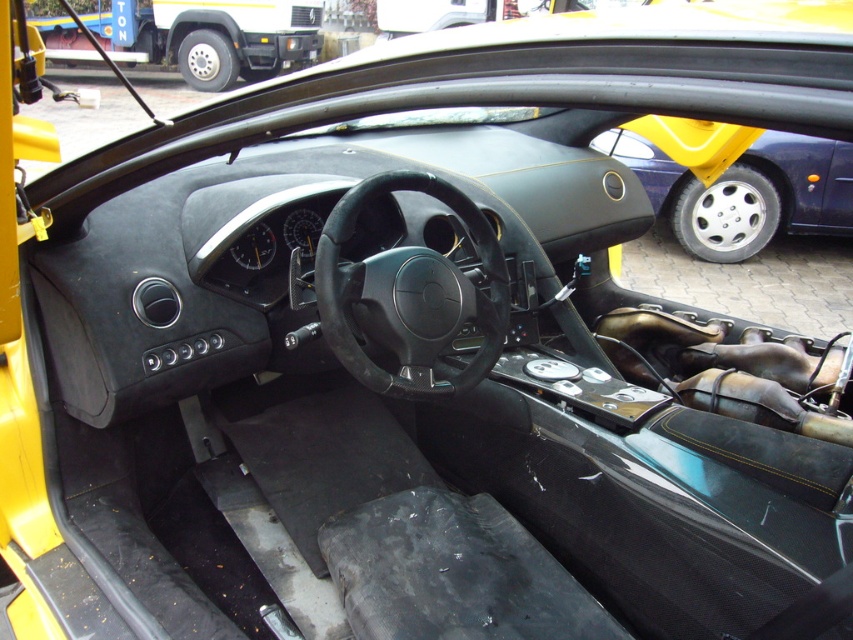
Is black leather steering wheel at center behind metallic silver wheel at right?

No, it is not.

Is black leather steering wheel at center above metallic silver wheel at right?

Incorrect, black leather steering wheel at center is not positioned above metallic silver wheel at right.

The height and width of the screenshot is (640, 853). In order to click on black leather steering wheel at center in this screenshot , I will do `click(409, 296)`.

Where is `black leather steering wheel at center`? The height and width of the screenshot is (640, 853). black leather steering wheel at center is located at coordinates (409, 296).